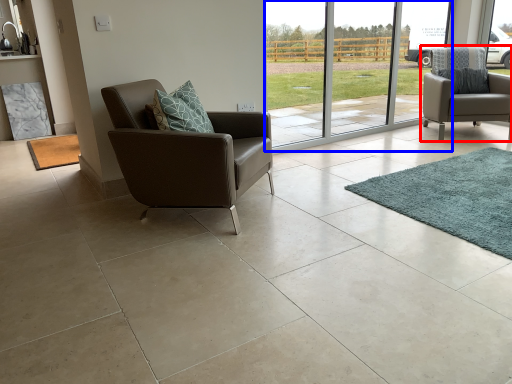
Question: Which point is further to the camera, chair (highlighted by a red box) or glass door (highlighted by a blue box)?

Choices:
 (A) chair
 (B) glass door

Answer: (A)